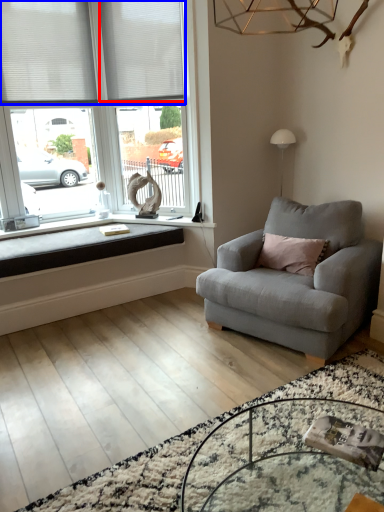
Question: Among these objects, which one is nearest to the camera, blind (highlighted by a red box) or blind (highlighted by a blue box)?

Choices:
 (A) blind
 (B) blind

Answer: (B)